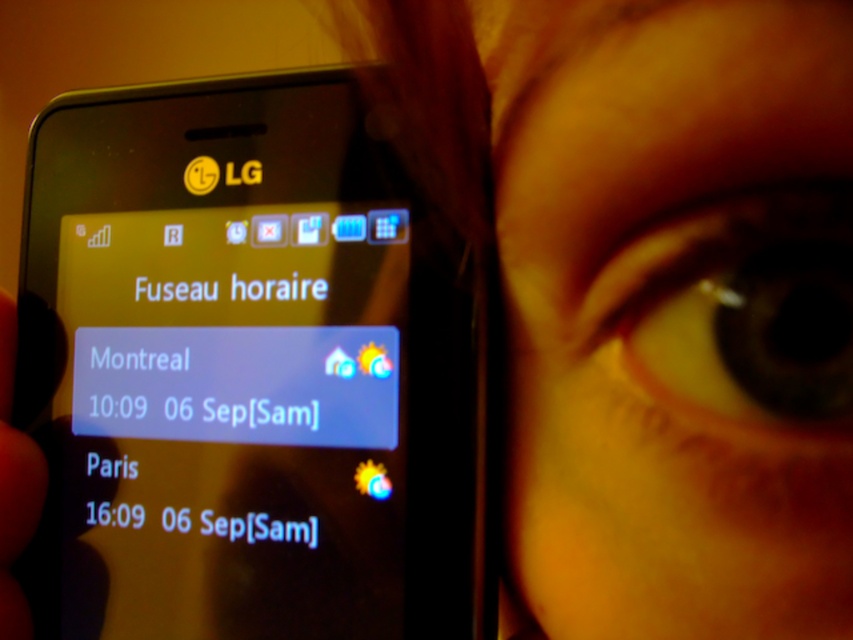
Question: Is black glossy smartphone at center thinner than matte black phone at left?

Choices:
 (A) yes
 (B) no

Answer: (B)

Question: Can you confirm if yellow skin at center is smaller than black matte text at upper center?

Choices:
 (A) no
 (B) yes

Answer: (A)

Question: Among these points, which one is farthest from the camera?

Choices:
 (A) 602,164
 (B) 170,292

Answer: (B)

Question: Which point is farther to the camera?

Choices:
 (A) (358, 218)
 (B) (28, 621)
 (C) (785, 228)
 (D) (807, 32)

Answer: (B)

Question: Does yellow matte eye at upper right appear over black matte text at upper center?

Choices:
 (A) no
 (B) yes

Answer: (A)

Question: Which is nearer to the yellow skin at center?

Choices:
 (A) yellow matte eye at upper right
 (B) black matte text at upper center
 (C) black glossy smartphone at center

Answer: (A)